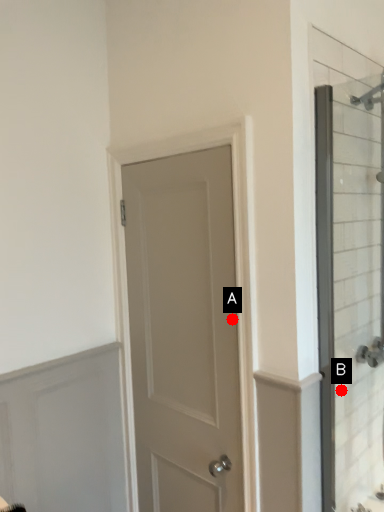
Question: Two points are circled on the image, labeled by A and B beside each circle. Which point appears closest to the camera in this image?

Choices:
 (A) A is closer
 (B) B is closer

Answer: (A)